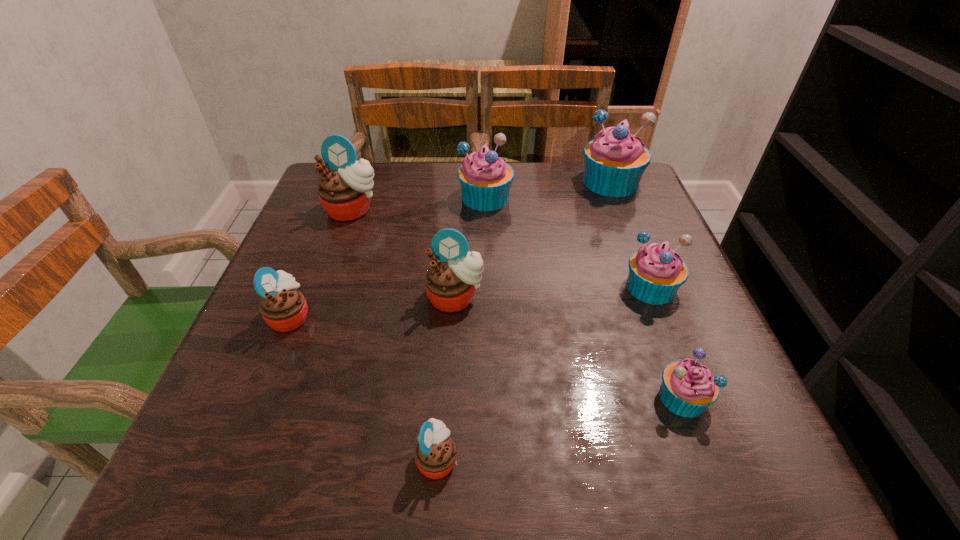
This screenshot has height=540, width=960. I want to click on the biggest blue muffin, so click(615, 160).

This screenshot has height=540, width=960. Identify the location of the biggest pink muffin. [344, 192].

This screenshot has height=540, width=960. I want to click on the leftmost blue muffin, so click(485, 178).

Where is `the second biggest pink muffin`? Image resolution: width=960 pixels, height=540 pixels. the second biggest pink muffin is located at coordinates (451, 281).

This screenshot has width=960, height=540. In order to click on the third biggest pink muffin in this screenshot , I will do `click(284, 308)`.

Locate an element on the screen. the third farthest blue muffin is located at coordinates (656, 272).

Image resolution: width=960 pixels, height=540 pixels. In order to click on the second nearest object in this screenshot , I will do `click(688, 388)`.

Image resolution: width=960 pixels, height=540 pixels. I want to click on the smallest blue muffin, so click(x=688, y=388).

This screenshot has width=960, height=540. Find the location of `the smallest pink muffin`. the smallest pink muffin is located at coordinates (435, 455).

The width and height of the screenshot is (960, 540). I want to click on the nearest object, so click(x=435, y=455).